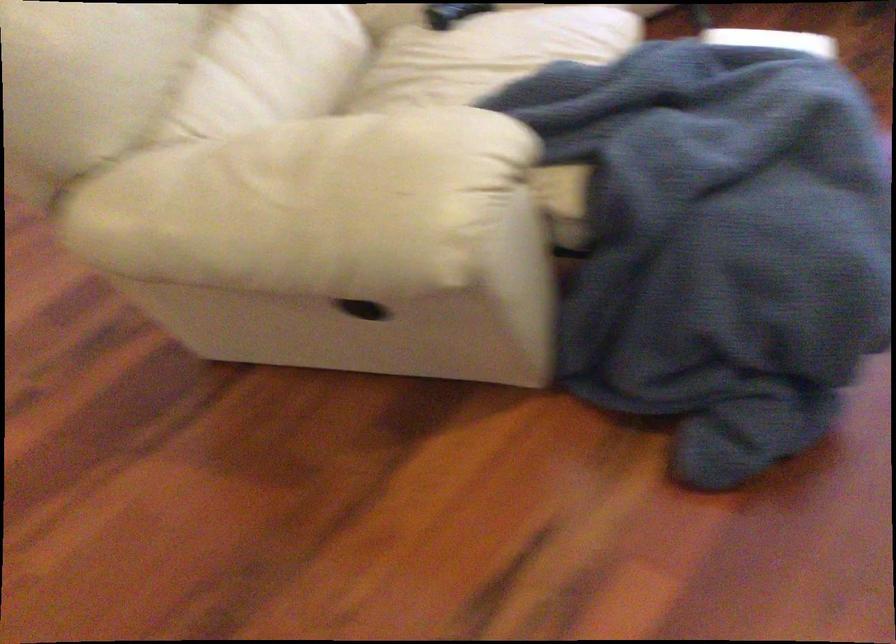
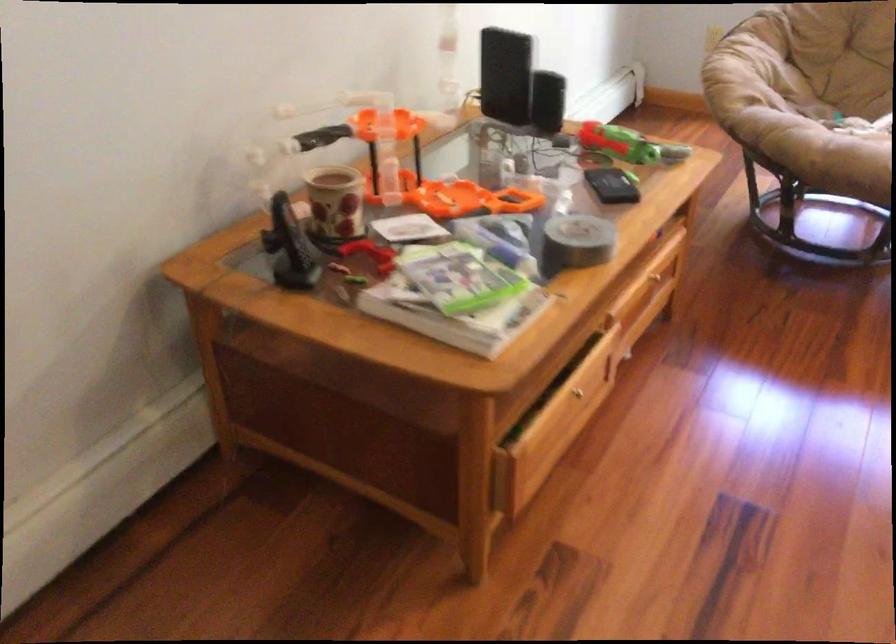
Looking at this image, which direction would the cameraman need to move to produce the second image?

The cameraman moved toward left, forward.